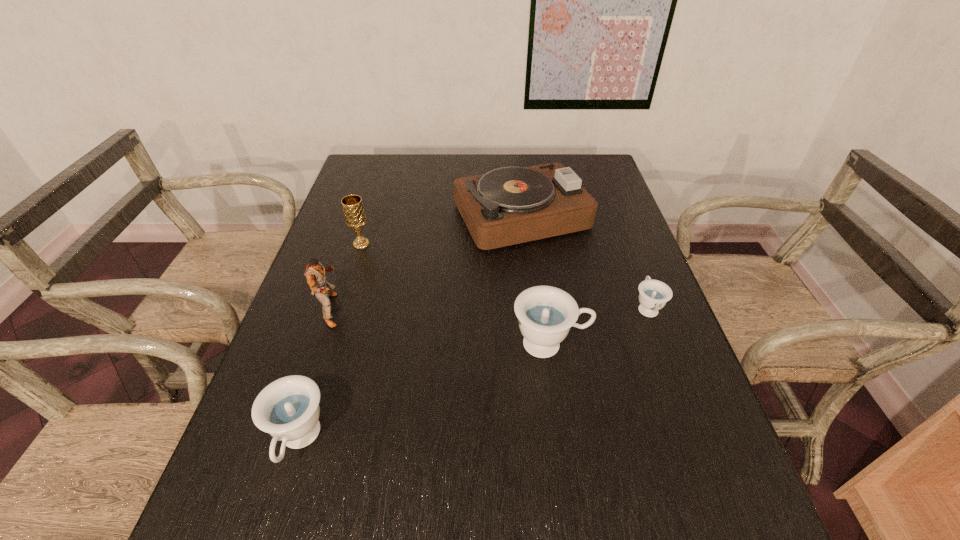
Where is `teacup that is at the right edge`? teacup that is at the right edge is located at coordinates (654, 294).

You are a GUI agent. You are given a task and a screenshot of the screen. Output one action in this format:
    pyautogui.click(x=<x>, y=<y>)
    Task: Click on the record player that is at the right edge
    The image size is (960, 540).
    Given the screenshot: What is the action you would take?
    pyautogui.click(x=506, y=206)

In order to click on object that is at the near left corner in this screenshot , I will do `click(288, 409)`.

Where is `object that is at the far right corner`? object that is at the far right corner is located at coordinates (x=506, y=206).

You are a GUI agent. You are given a task and a screenshot of the screen. Output one action in this format:
    pyautogui.click(x=<x>, y=<y>)
    Task: Click on the free location at the far edge
    
    Given the screenshot: What is the action you would take?
    (548, 159)

The width and height of the screenshot is (960, 540). I want to click on free space at the left edge of the desktop, so click(x=380, y=214).

Where is `vacant space at the right edge`? The height and width of the screenshot is (540, 960). vacant space at the right edge is located at coordinates (677, 425).

Locate an element on the screen. This screenshot has width=960, height=540. vacant space at the far left corner of the desktop is located at coordinates (368, 157).

Identify the location of free space between the puncher and the shortest teacup. (489, 308).

Locate an element on the screen. The width and height of the screenshot is (960, 540). free spot between the record player and the puncher is located at coordinates (427, 263).